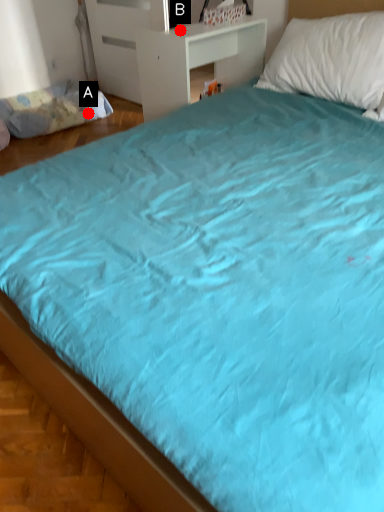
Question: Two points are circled on the image, labeled by A and B beside each circle. Which point appears farthest from the camera in this image?

Choices:
 (A) A is further
 (B) B is further

Answer: (A)